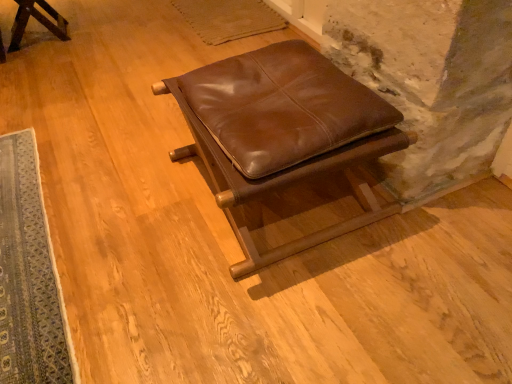
Question: Do you think matte brown leather stool at upper left, marked as the second furniture in a front-to-back arrangement, is within brown leather ottoman at center, which ranks as the first furniture in bottom-to-top order, or outside of it?

Choices:
 (A) outside
 (B) inside

Answer: (A)

Question: Based on their sizes in the image, would you say matte brown leather stool at upper left, the 1th furniture viewed from the left, is bigger or smaller than brown leather ottoman at center, which ranks as the 2th furniture in back-to-front order?

Choices:
 (A) big
 (B) small

Answer: (B)

Question: Which object is positioned closest to the blue woven rug at lower left?

Choices:
 (A) matte brown leather stool at upper left, placed as the 2th furniture when sorted from bottom to top
 (B) brown leather ottoman at center, which ranks as the 2th furniture in back-to-front order

Answer: (B)

Question: Which object is positioned farthest from the blue woven rug at lower left?

Choices:
 (A) brown leather ottoman at center, which ranks as the first furniture in bottom-to-top order
 (B) matte brown leather stool at upper left, the first furniture when ordered from top to bottom

Answer: (B)